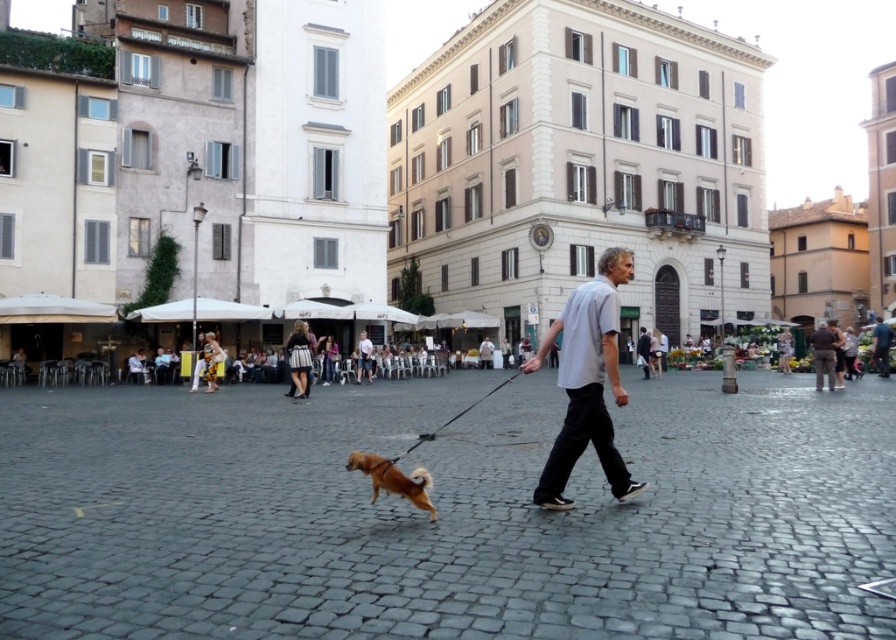
Question: Which is nearer to the golden fur dog at center?

Choices:
 (A) light gray cotton shirt at center
 (B) white cotton shirt at center

Answer: (B)

Question: Does white cotton shirt at center appear under golden fur dog at center?

Choices:
 (A) yes
 (B) no

Answer: (B)

Question: Considering the relative positions of white cotton shirt at center and light gray cotton shirt at center in the image provided, where is white cotton shirt at center located with respect to light gray cotton shirt at center?

Choices:
 (A) above
 (B) below

Answer: (A)

Question: Estimate the real-world distances between objects in this image. Which object is farther from the light gray cotton shirt at center?

Choices:
 (A) golden fur dog at center
 (B) white cotton shirt at center

Answer: (A)

Question: Does golden fur dog at center have a smaller size compared to light gray cotton shirt at center?

Choices:
 (A) yes
 (B) no

Answer: (A)

Question: Which point is farther to the camera?

Choices:
 (A) (403, 477)
 (B) (582, 416)
 (C) (365, 365)

Answer: (C)